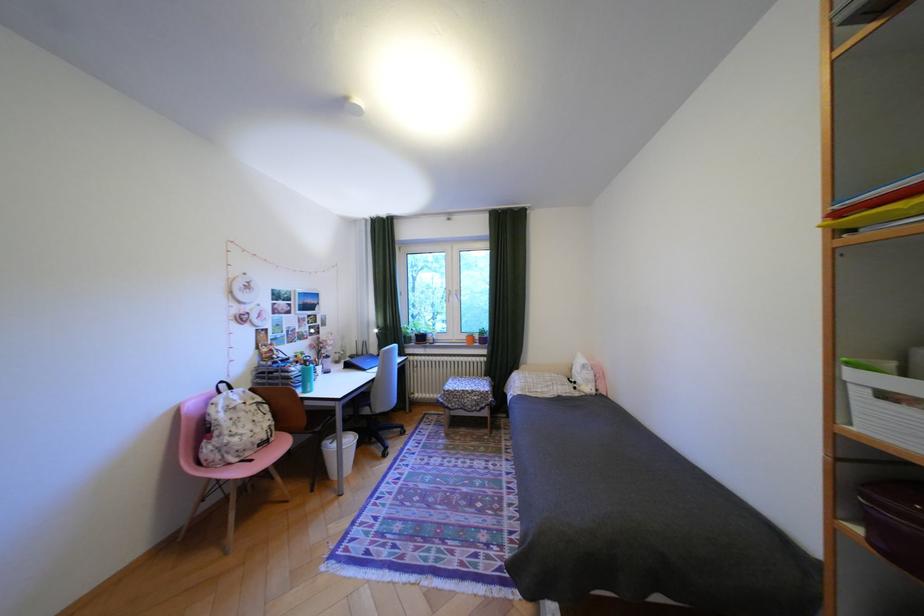
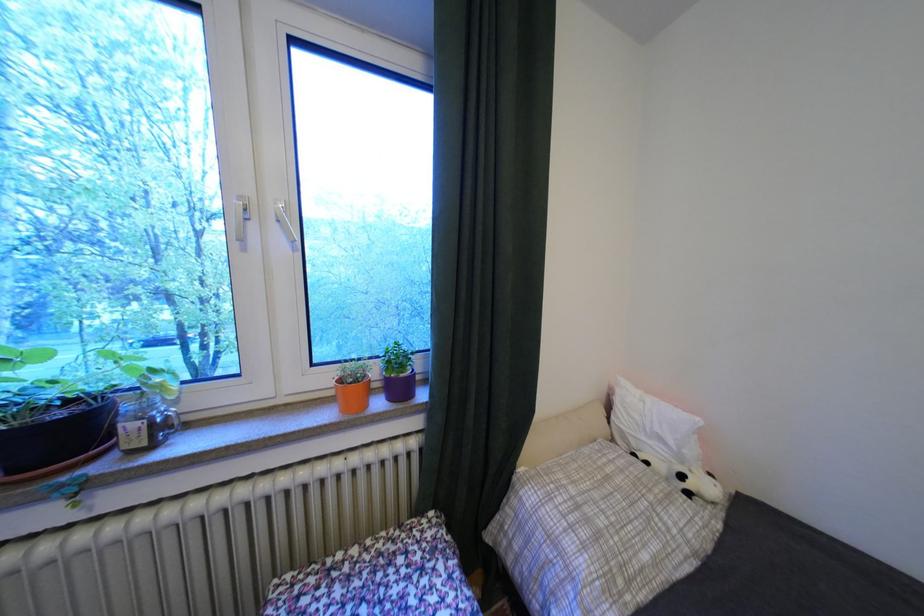
In the second image, find the point that corresponds to point (553, 392) in the first image.

(667, 562)